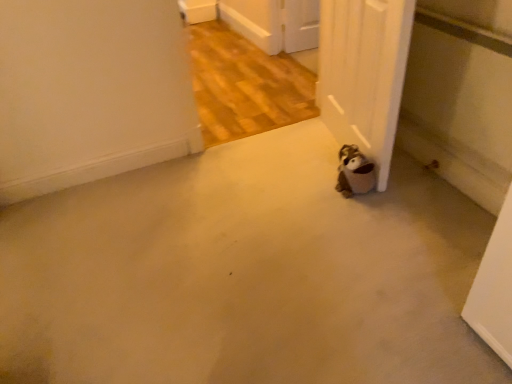
You are a GUI agent. You are given a task and a screenshot of the screen. Output one action in this format:
    pyautogui.click(x=<x>, y=<y>)
    Task: Click on the free space that is to the left of white matte door at lower right
    
    Given the screenshot: What is the action you would take?
    pyautogui.click(x=275, y=167)